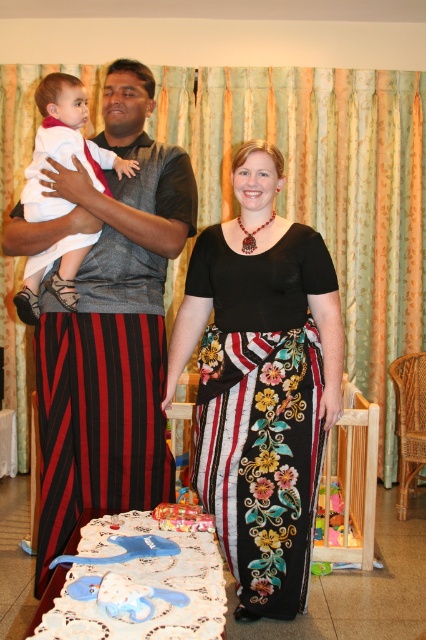
You are a photographer setting up for a family portrait. You notice two skirts at the center of the image, the floral fabric skirt at center and the black floral skirt at center. Which skirt is visible on top?

The floral fabric skirt at center is positioned over the black floral skirt at center, making it the visible one on top.

You are a guest at a cultural event and see two skirts displayed on a table in front of you. The skirts are labeled as the floral fabric skirt at center and the black floral skirt at center. Which one has a bigger size?

The floral fabric skirt at center has a larger size compared to the black floral skirt at center.